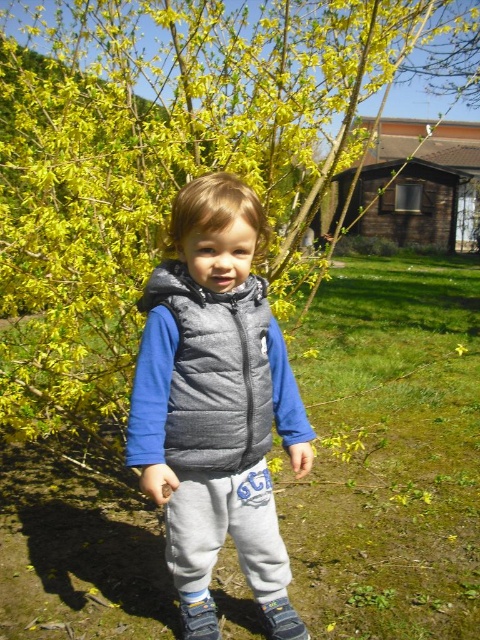
Question: Can you confirm if gray puffer vest at center is thinner than dark gray puffer vest at center?

Choices:
 (A) no
 (B) yes

Answer: (B)

Question: Which point is closer to the camera taking this photo?

Choices:
 (A) (381, 536)
 (B) (186, 522)

Answer: (B)

Question: Which is nearer to the dark gray puffer vest at center?

Choices:
 (A) gray puffer vest at center
 (B) green grass at center

Answer: (A)

Question: Considering the relative positions of green grass at center and gray fleece pants at center in the image provided, where is green grass at center located with respect to gray fleece pants at center?

Choices:
 (A) above
 (B) below

Answer: (A)

Question: Which point is closer to the camera taking this photo?

Choices:
 (A) (196, 333)
 (B) (428, 285)
 (C) (144, 392)

Answer: (C)

Question: Can you confirm if gray puffer vest at center is positioned above gray fleece pants at center?

Choices:
 (A) no
 (B) yes

Answer: (B)